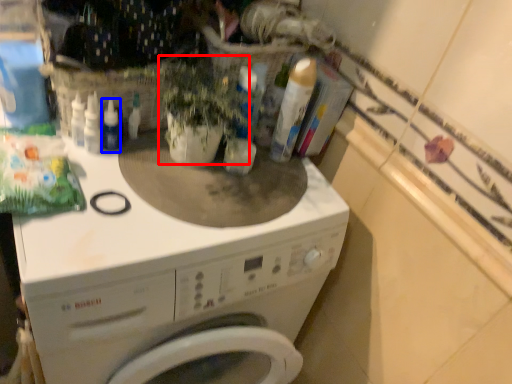
Question: Which object is further to the camera taking this photo, plant (highlighted by a red box) or bottle (highlighted by a blue box)?

Choices:
 (A) plant
 (B) bottle

Answer: (B)